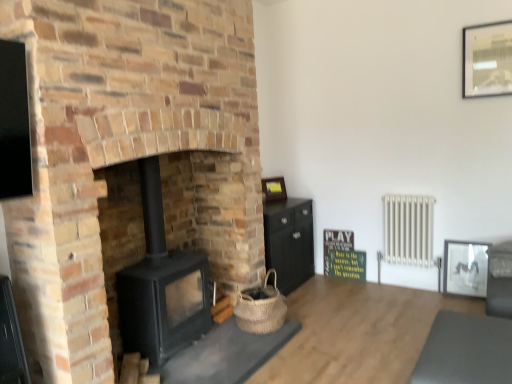
Find the location of a particular element. The width and height of the screenshot is (512, 384). free location to the right of black matte wood burning stove at center-left is located at coordinates (226, 344).